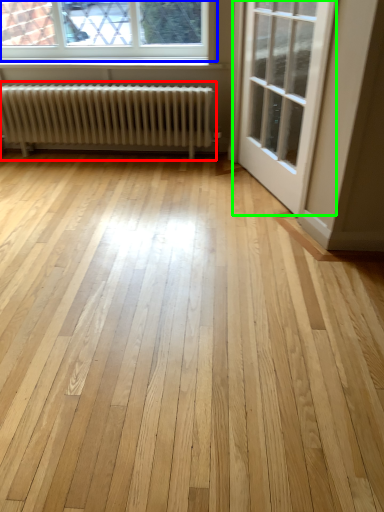
Question: Which is farther away from radiator (highlighted by a red box)? window (highlighted by a blue box) or door (highlighted by a green box)?

Choices:
 (A) window
 (B) door

Answer: (B)